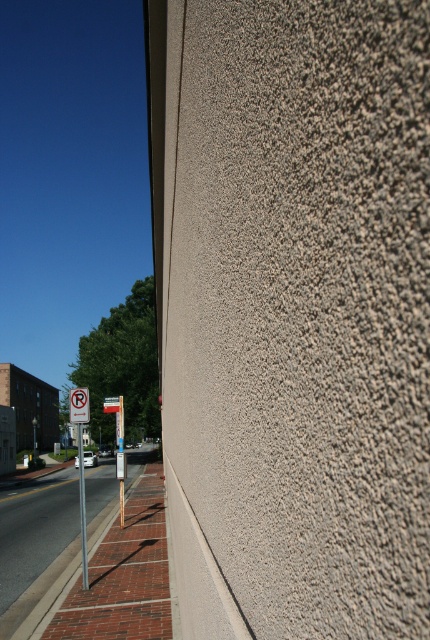
You are a delivery person trying to park your bike. The bike requires 6 feet of space. There is a brick pavement at lower left and a metallic pole at left in the image. Is there enough space between them to park your bike?

The distance between the brick pavement at lower left and the metallic pole at left is 6.51 feet, which is more than the required 6 feet. Therefore, there is enough space to park the bike between them.

You are standing at the center of the image. Which direction should you move to reach the brick pavement at lower left?

Since the brick pavement at lower left is located at coordinates point (34, 531), you should move towards the lower left direction to reach it.

You are a delivery driver who needs to park your truck near the street. You see the metallic pole at left and the white plastic sign at upper left. Which object is larger and could potentially block your parking space?

The metallic pole at left is bigger than the white plastic sign at upper left, so it is more likely to block the parking space.